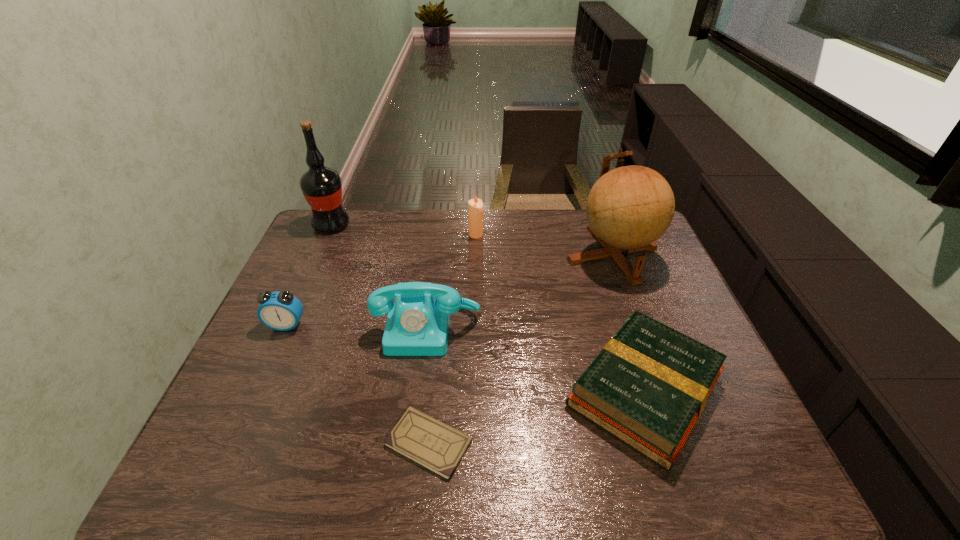
Identify the location of free space at the near right corner of the desktop. (763, 481).

At what (x,y) coordinates should I click in order to perform the action: click on blank region between the second shortest object and the telephone. Please return your answer as a coordinate pair (x, y). Looking at the image, I should click on (536, 359).

At what (x,y) coordinates should I click in order to perform the action: click on free space between the globe and the wine bottle. Please return your answer as a coordinate pair (x, y). Image resolution: width=960 pixels, height=540 pixels. Looking at the image, I should click on (472, 240).

Locate an element on the screen. free spot between the shortest object and the candle is located at coordinates (452, 339).

At what (x,y) coordinates should I click in order to perform the action: click on free space between the shortest object and the telephone. Please return your answer as a coordinate pair (x, y). This screenshot has height=540, width=960. Looking at the image, I should click on (428, 385).

This screenshot has width=960, height=540. Find the location of `vacant space that is in between the hardback book and the candle`. vacant space that is in between the hardback book and the candle is located at coordinates (560, 313).

Where is `vacant area between the candle and the globe`? vacant area between the candle and the globe is located at coordinates (544, 245).

Locate an element on the screen. The width and height of the screenshot is (960, 540). free spot between the telephone and the wine bottle is located at coordinates (379, 276).

I want to click on vacant space that's between the wine bottle and the telephone, so click(x=379, y=276).

Where is `object that is the sixth closest to the telephone`? The height and width of the screenshot is (540, 960). object that is the sixth closest to the telephone is located at coordinates (321, 186).